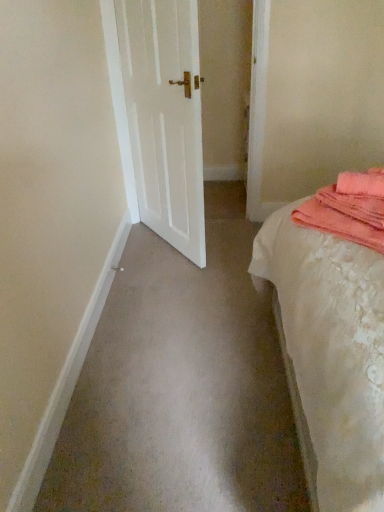
In order to click on white matte door at center in this screenshot , I will do `click(165, 117)`.

I want to click on white matte door at center, so click(165, 117).

Considering the positions of point (348, 179) and point (147, 44), is point (348, 179) closer or farther from the camera than point (147, 44)?

Point (348, 179).

Which of these two, pink towel at right or white matte door at center, is wider?

pink towel at right.

Which is more to the right, pink towel at right or white matte door at center?

pink towel at right is more to the right.

Who is shorter, pink towel at right or white matte door at center?

With less height is pink towel at right.

Considering the relative sizes of white matte door at center and pink towel at right in the image provided, is white matte door at center wider than pink towel at right?

Incorrect, the width of white matte door at center does not surpass that of pink towel at right.

Between white matte door at center and pink towel at right, which one has less height?

pink towel at right is shorter.

Are white matte door at center and pink towel at right far apart?

Yes.

Based on the photo, is white matte door at center aimed at pink towel at right?

No, white matte door at center is not aimed at pink towel at right.

Considering the points (260, 260) and (146, 71), which point is in front, point (260, 260) or point (146, 71)?

The point (260, 260) is closer.

Is white lace bed at right placed right next to white matte door at center?

No, white lace bed at right is not with white matte door at center.

How different are the orientations of white lace bed at right and white matte door at center in degrees?

The facing directions of white lace bed at right and white matte door at center are 146 degrees apart.

Considering their positions, is white lace bed at right located in front of or behind white matte door at center?

white lace bed at right is in front of white matte door at center.

Where is `material lying on the right of white lace bed at right`? This screenshot has height=512, width=384. material lying on the right of white lace bed at right is located at coordinates (348, 209).

Considering the sizes of pink towel at right and white lace bed at right in the image, is pink towel at right bigger or smaller than white lace bed at right?

Considering their sizes, pink towel at right takes up less space than white lace bed at right.

Between pink towel at right and white lace bed at right, which one appears on the left side from the viewer's perspective?

Positioned to the left is white lace bed at right.

How different are the orientations of pink towel at right and white lace bed at right in degrees?

52 degrees.

Is pink towel at right inside white lace bed at right?

Yes, pink towel at right is surrounded by white lace bed at right.

At what (x,y) coordinates should I click in order to perform the action: click on bed that is under the pink towel at right (from a real-world perspective). Please return your answer as a coordinate pair (x, y). This screenshot has width=384, height=512. Looking at the image, I should click on (333, 332).

From the picture: Which is behind, white lace bed at right or pink towel at right?

pink towel at right is behind.

Where is `door above the white lace bed at right (from a real-world perspective)`? This screenshot has width=384, height=512. door above the white lace bed at right (from a real-world perspective) is located at coordinates (165, 117).

Consider the image. From a real-world perspective, which is physically above, white matte door at center or white lace bed at right?

white matte door at center is physically above.

From the image's perspective, would you say white matte door at center is positioned over white lace bed at right?

Indeed, from the image's perspective, white matte door at center is shown above white lace bed at right.

This screenshot has height=512, width=384. What are the coordinates of `door that appears below the pink towel at right (from a real-world perspective)` in the screenshot? It's located at (165, 117).

Identify the location of door above the pink towel at right (from the image's perspective). (165, 117).

When comparing their distances from pink towel at right, does white lace bed at right or white matte door at center seem closer?

Among the two, white lace bed at right is located nearer to pink towel at right.

Estimate the real-world distances between objects in this image. Which object is further from white lace bed at right, pink towel at right or white matte door at center?

Among the two, white matte door at center is located further to white lace bed at right.

Estimate the real-world distances between objects in this image. Which object is further from white matte door at center, white lace bed at right or pink towel at right?

The object further to white matte door at center is pink towel at right.

Based on their spatial positions, is white matte door at center or pink towel at right closer to white lace bed at right?

Based on the image, pink towel at right appears to be nearer to white lace bed at right.

Which object lies nearer to the anchor point pink towel at right, white matte door at center or white lace bed at right?

white lace bed at right is closer to pink towel at right.

Based on their spatial positions, is pink towel at right or white lace bed at right further from white matte door at center?

pink towel at right.

Where is `material between white lace bed at right and white matte door at center from front to back`? This screenshot has width=384, height=512. material between white lace bed at right and white matte door at center from front to back is located at coordinates (348, 209).